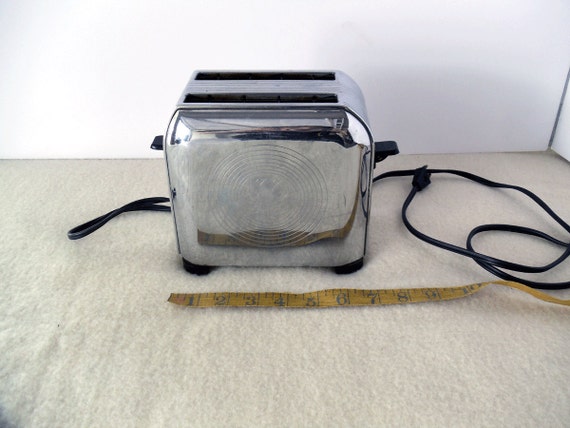
Locate an element on the screen. button on toaster is located at coordinates (388, 146), (157, 143).